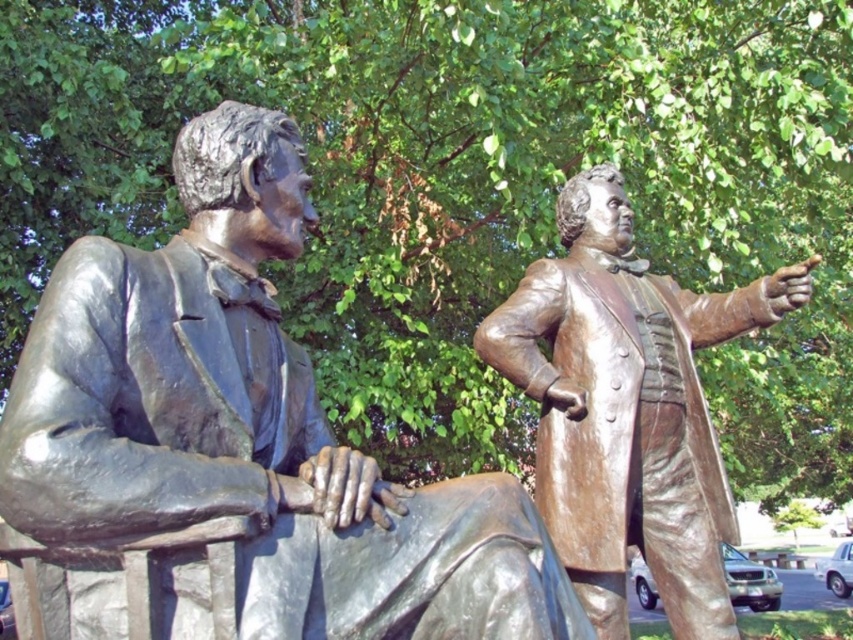
Based on the photo, you are standing in front of the two bronze statues in the image. If you were to draw a straight line from your current position to the point at coordinates point (250, 426), which statue would this line lead you to?

The line would lead you to the bronze statue at left, as the coordinates point (250, 426) correspond to that statue.